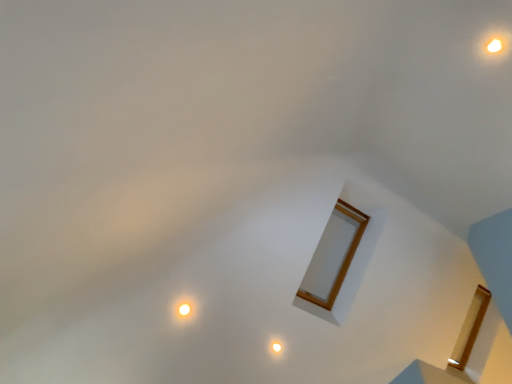
Question: From a real-world perspective, is matte white light at lower left physically located above or below matte white light at center?

Choices:
 (A) below
 (B) above

Answer: (B)

Question: Is matte white light at lower left inside the boundaries of matte white light at center, or outside?

Choices:
 (A) outside
 (B) inside

Answer: (A)

Question: From their relative heights in the image, would you say matte white light at lower left is taller or shorter than matte white light at center?

Choices:
 (A) tall
 (B) short

Answer: (A)

Question: In the image, is matte white light at center positioned in front of or behind matte white light at lower left?

Choices:
 (A) behind
 (B) front

Answer: (A)

Question: In terms of width, does matte white light at center look wider or thinner when compared to matte white light at lower left?

Choices:
 (A) wide
 (B) thin

Answer: (B)

Question: From a real-world perspective, is matte white light at center physically located above or below matte white light at lower left?

Choices:
 (A) above
 (B) below

Answer: (B)

Question: Is matte white light at center situated inside matte white light at lower left or outside?

Choices:
 (A) outside
 (B) inside

Answer: (A)